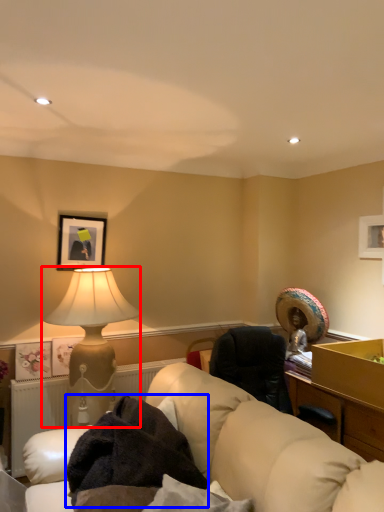
Question: Which of the following is the closest to the observer, lamp (highlighted by a red box) or blanket (highlighted by a blue box)?

Choices:
 (A) lamp
 (B) blanket

Answer: (B)